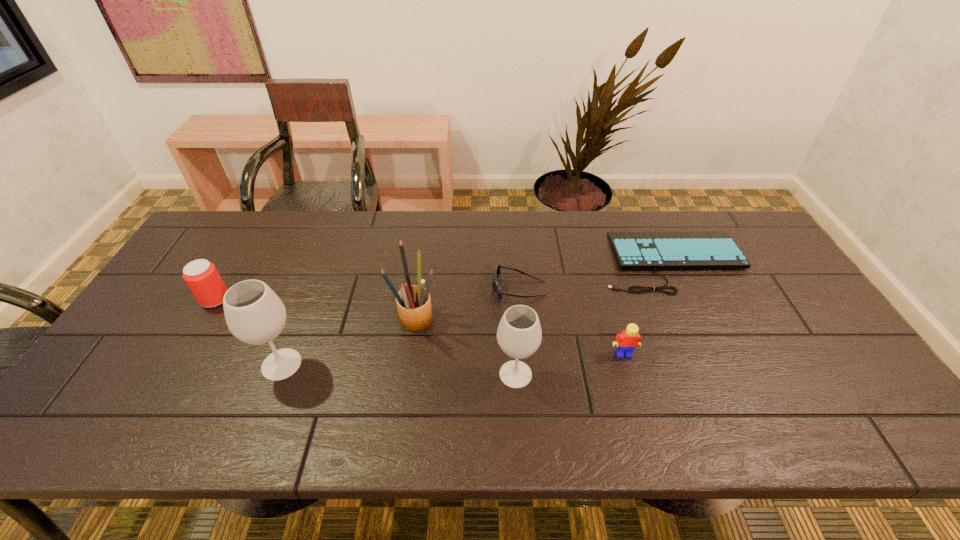
The image size is (960, 540). What are the coordinates of `the sixth object from right to left` in the screenshot? It's located at (254, 314).

This screenshot has width=960, height=540. Identify the location of the taller wineglass. (254, 314).

Locate an element on the screen. The width and height of the screenshot is (960, 540). the right wineglass is located at coordinates [519, 335].

Where is `computer keyboard`? The height and width of the screenshot is (540, 960). computer keyboard is located at coordinates (705, 249).

Locate an element on the screen. sunglasses is located at coordinates (497, 272).

Where is `the leftmost object`? The image size is (960, 540). the leftmost object is located at coordinates (201, 276).

Locate an element on the screen. The height and width of the screenshot is (540, 960). pencil box is located at coordinates (413, 302).

Locate an element on the screen. Lego is located at coordinates (627, 341).

Where is `free space located 0.330m on the right of the taller wineglass`? free space located 0.330m on the right of the taller wineglass is located at coordinates (438, 364).

Image resolution: width=960 pixels, height=540 pixels. Identify the location of vacant space located on the left of the shorter wineglass. (409, 374).